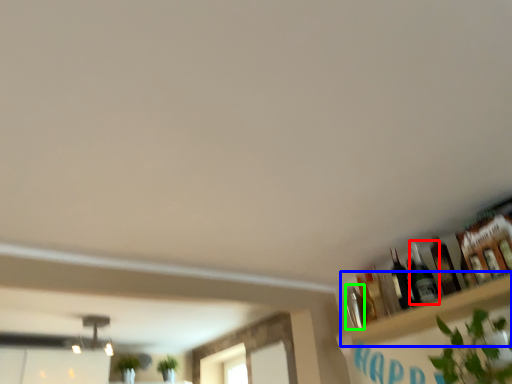
Question: Which is farther away from bottle (highlighted by a red box)? shelf (highlighted by a blue box) or bottle (highlighted by a green box)?

Choices:
 (A) shelf
 (B) bottle

Answer: (B)